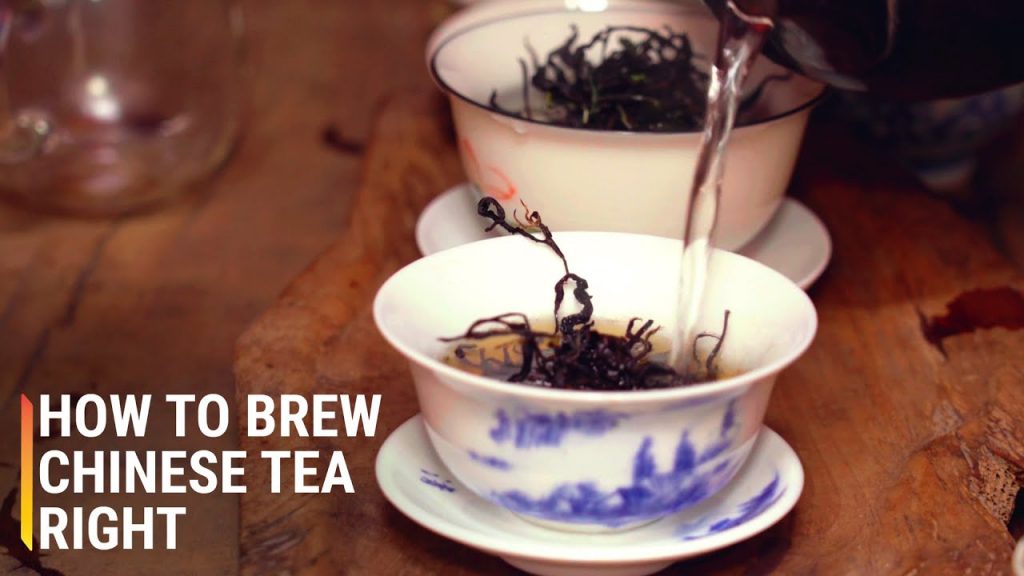
Find the location of `ceramic design`. ceramic design is located at coordinates (640, 477), (730, 521), (488, 189), (436, 488), (542, 423).